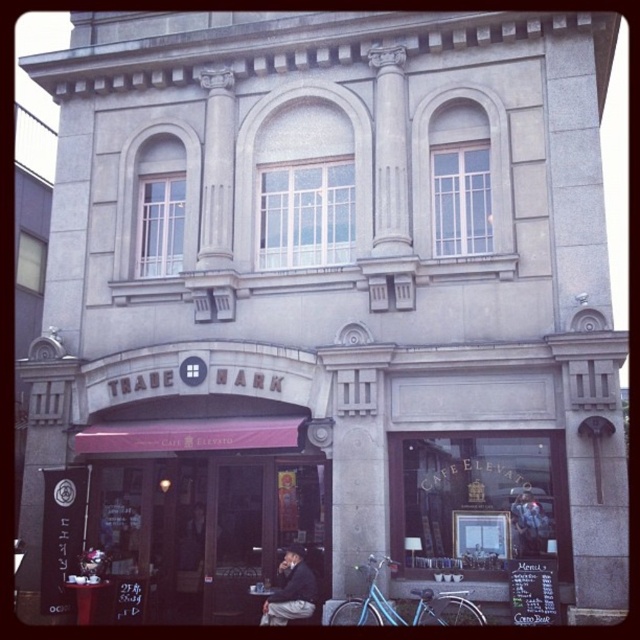
Is dark gray suit at center to the left of dark gray jacket at center from the viewer's perspective?

In fact, dark gray suit at center is to the right of dark gray jacket at center.

Is dark gray suit at center taller than dark gray jacket at center?

No.

What do you see at coordinates (291, 589) in the screenshot? I see `dark gray suit at center` at bounding box center [291, 589].

At what (x,y) coordinates should I click in order to perform the action: click on dark gray suit at center. Please return your answer as a coordinate pair (x, y). Looking at the image, I should click on (291, 589).

Can you confirm if matte pink awning at lower left is wider than dark gray suit at center?

In fact, matte pink awning at lower left might be narrower than dark gray suit at center.

Does matte pink awning at lower left appear over dark gray suit at center?

No.

Locate an element on the screen. matte pink awning at lower left is located at coordinates (208, 508).

Does matte pink awning at lower left lie in front of dark gray jacket at center?

No, matte pink awning at lower left is further to the viewer.

Which is in front, point (221, 433) or point (193, 513)?

Point (221, 433) is more forward.

Identify the location of matte pink awning at lower left. The height and width of the screenshot is (640, 640). (208, 508).